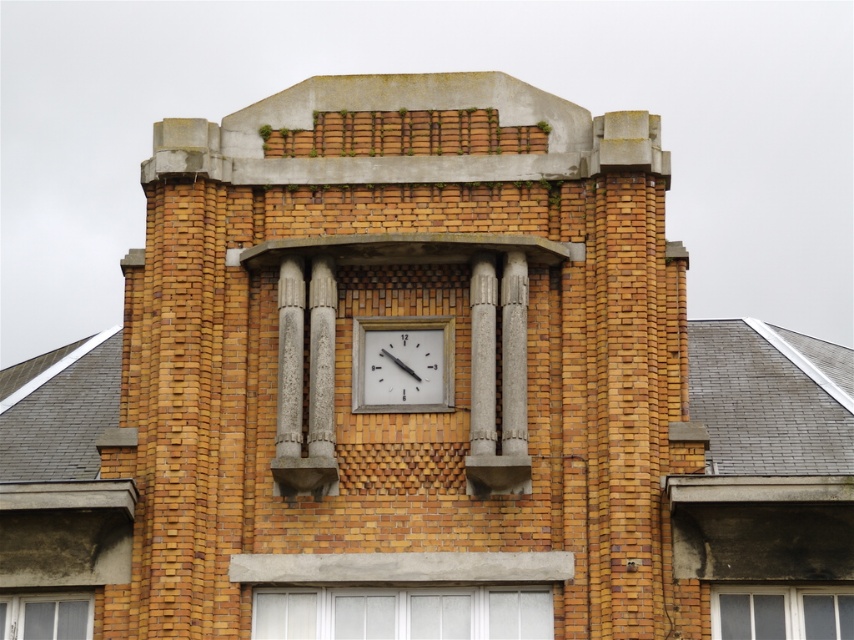
Is matte glass window at lower right bigger than clear glass window at lower left?

Indeed, matte glass window at lower right has a larger size compared to clear glass window at lower left.

Does matte glass window at lower right have a lesser width compared to clear glass window at lower left?

No.

Describe the element at coordinates (782, 612) in the screenshot. I see `matte glass window at lower right` at that location.

Identify the location of matte glass window at lower right. (782, 612).

Between white matte clock at center and clear glass window at lower left, which one is positioned higher?

white matte clock at center

Is white matte clock at center thinner than clear glass window at lower left?

Incorrect, white matte clock at center's width is not less than clear glass window at lower left's.

I want to click on white matte clock at center, so click(402, 364).

Is brick clock at center smaller than white matte clock at center?

No.

Does brick clock at center appear over white matte clock at center?

Correct, brick clock at center is located above white matte clock at center.

Who is more distant from viewer, (106, 451) or (446, 356)?

Point (446, 356)

Find the location of a particular element. brick clock at center is located at coordinates (404, 316).